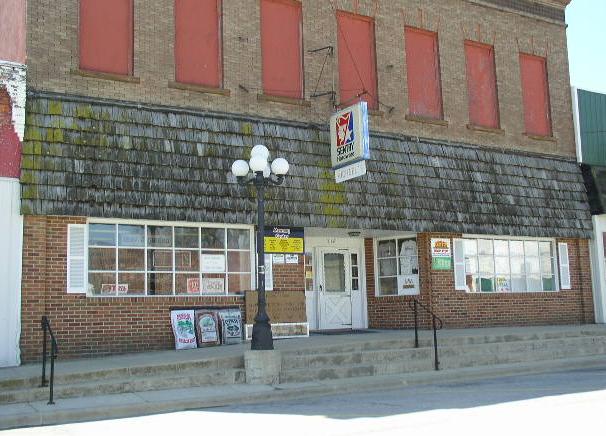
In order to click on glass windows in this screenshot , I will do `click(516, 268)`, `click(393, 258)`, `click(156, 257)`.